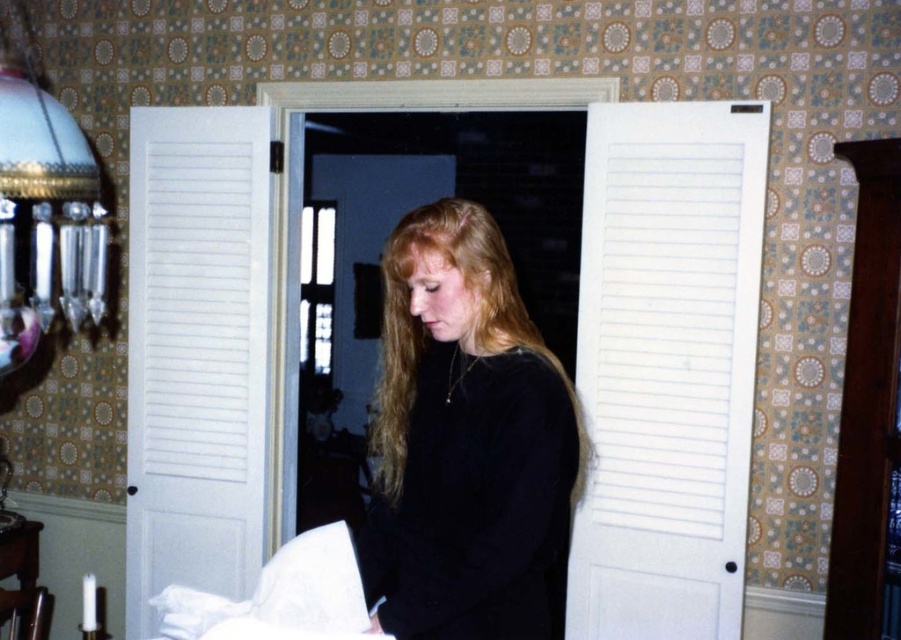
Is point (415, 330) behind point (65, 148)?

No.

Between point (438, 337) and point (93, 230), which one is positioned behind?

The point (93, 230) is behind.

Where is `black velvet sweater at center`? black velvet sweater at center is located at coordinates (466, 442).